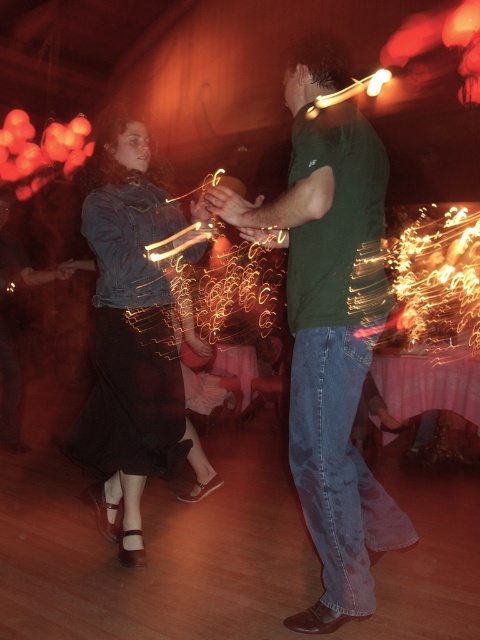
You are at a party and want to take a photo of the green matte shirt at center and the denim jacket at left. Which one is positioned higher in the frame?

The green matte shirt at center is located above the denim jacket at left, so it is positioned higher in the frame.

You are at a party and want to take a photo of the green matte shirt at center and the denim jacket at left. Which one will appear larger in the photo?

The green matte shirt at center will appear larger in the photo because it is closer to the viewer than the denim jacket at left.